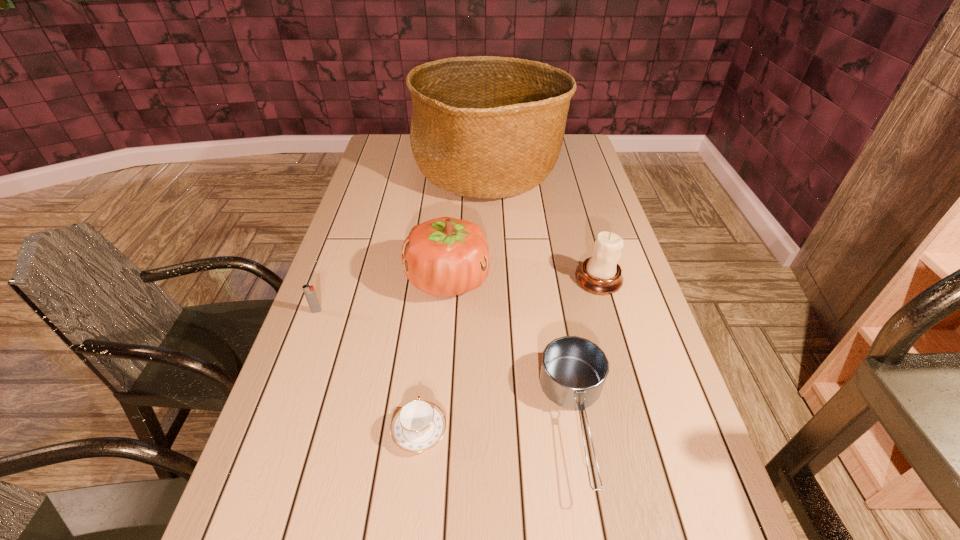
Find the location of a particular element. free region located 0.210m on the back of the igniter is located at coordinates (336, 257).

Find the location of a particular element. vacant space located 0.050m on the side with the handle of the teacup is located at coordinates (x=424, y=386).

Find the location of a particular element. vacant space located 0.390m on the side with the handle of the teacup is located at coordinates (435, 281).

In order to click on vacant region located on the side with the handle of the teacup in this screenshot , I will do `click(428, 350)`.

What are the coordinates of `object at the far edge` in the screenshot? It's located at (481, 127).

Identify the location of object located at the left edge. This screenshot has height=540, width=960. (310, 294).

Where is `basket that is at the right edge`? The height and width of the screenshot is (540, 960). basket that is at the right edge is located at coordinates (481, 127).

Identify the location of candle holder positioned at the right edge. This screenshot has width=960, height=540. (600, 274).

At what (x,y) coordinates should I click in order to perform the action: click on saucepan present at the right edge. Please return your answer as a coordinate pair (x, y). The image size is (960, 540). Looking at the image, I should click on click(573, 371).

Identify the location of object that is at the far right corner. The height and width of the screenshot is (540, 960). (481, 127).